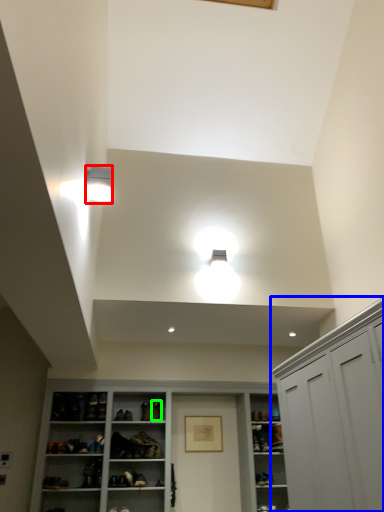
Question: Based on their relative distances, which object is farther from light fixture (highlighted by a red box)? Choose from cabinetry (highlighted by a blue box) and shoe (highlighted by a green box).

Choices:
 (A) cabinetry
 (B) shoe

Answer: (B)